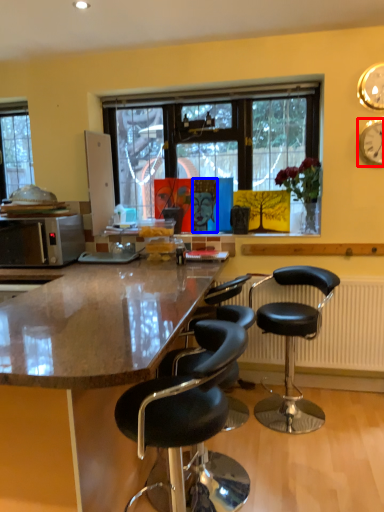
Question: Which object appears farthest to the camera in this image, clock (highlighted by a red box) or person (highlighted by a blue box)?

Choices:
 (A) clock
 (B) person

Answer: (B)